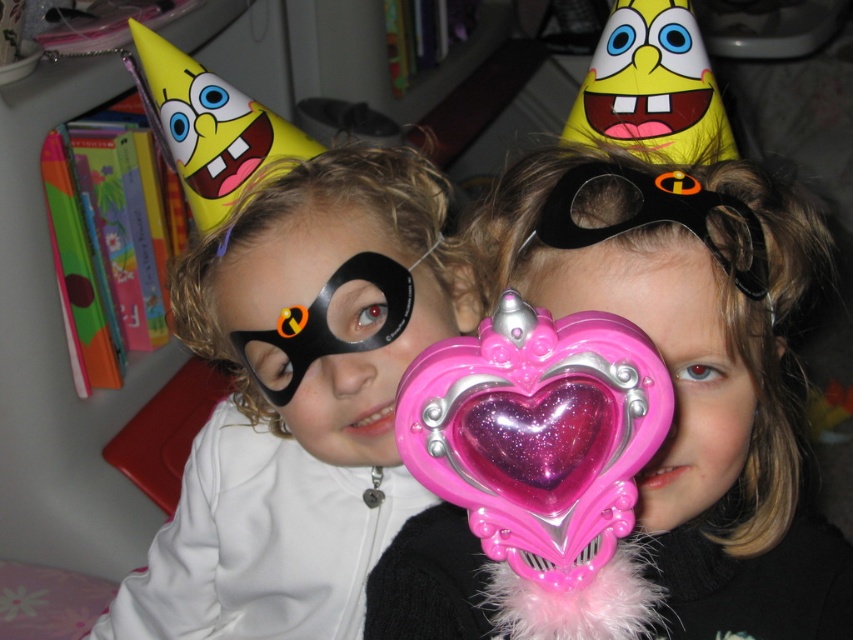
Question: Which point is farther to the camera?

Choices:
 (A) black matte mask at center
 (B) pink glitter heart at center
 (C) pink plastic heart at center

Answer: (A)

Question: Is pink glossy heart at center further to camera compared to pink glitter heart at center?

Choices:
 (A) yes
 (B) no

Answer: (B)

Question: Among these points, which one is farthest from the camera?

Choices:
 (A) (659, 205)
 (B) (717, 438)

Answer: (B)

Question: Which point is farther to the camera?

Choices:
 (A) pink plastic heart at center
 (B) black matte mask at upper center

Answer: (B)

Question: Does pink glitter heart at center appear under black matte mask at upper center?

Choices:
 (A) no
 (B) yes

Answer: (B)

Question: Can you confirm if pink plastic heart at center is wider than pink glitter heart at center?

Choices:
 (A) no
 (B) yes

Answer: (B)